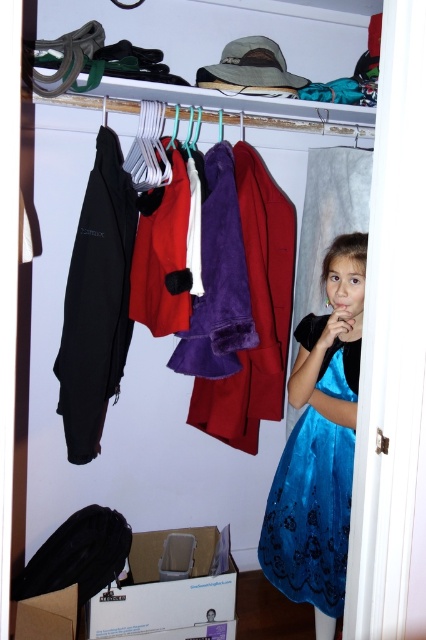
Question: Which object appears closest to the camera in this image?

Choices:
 (A) velvet blue dress at lower right
 (B) matte black jacket at left

Answer: (A)

Question: Which point appears closest to the camera in this image?

Choices:
 (A) (74, 275)
 (B) (302, 573)

Answer: (B)

Question: Can you confirm if velvet blue dress at lower right is positioned to the right of matte black jacket at left?

Choices:
 (A) yes
 (B) no

Answer: (A)

Question: Which object is farther from the camera taking this photo?

Choices:
 (A) matte black jacket at left
 (B) velvet blue dress at lower right

Answer: (A)

Question: Observing the image, what is the correct spatial positioning of velvet blue dress at lower right in reference to matte black jacket at left?

Choices:
 (A) below
 (B) above

Answer: (A)

Question: Does velvet blue dress at lower right have a lesser width compared to matte black jacket at left?

Choices:
 (A) yes
 (B) no

Answer: (B)